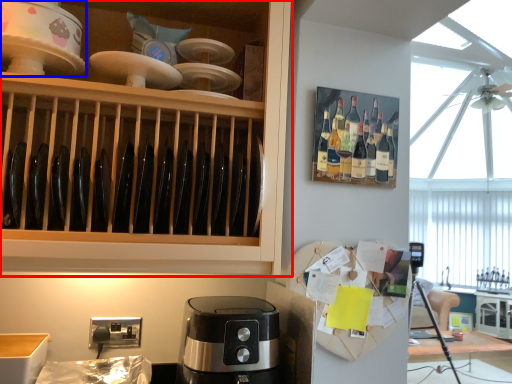
Question: Which point is closer to the camera, cabinetry (highlighted by a red box) or home appliance (highlighted by a blue box)?

Choices:
 (A) cabinetry
 (B) home appliance

Answer: (A)